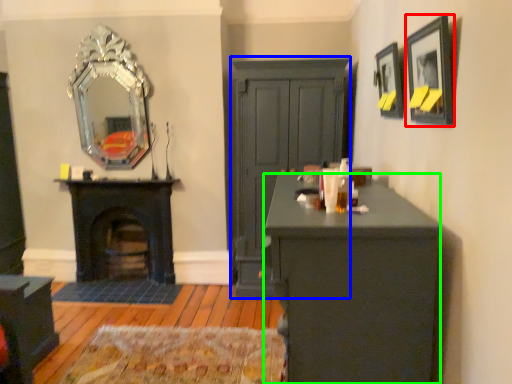
Question: Which object is the closest to the picture frame (highlighted by a red box)? Choose among these: dresser (highlighted by a blue box) or desk (highlighted by a green box).

Choices:
 (A) dresser
 (B) desk

Answer: (B)